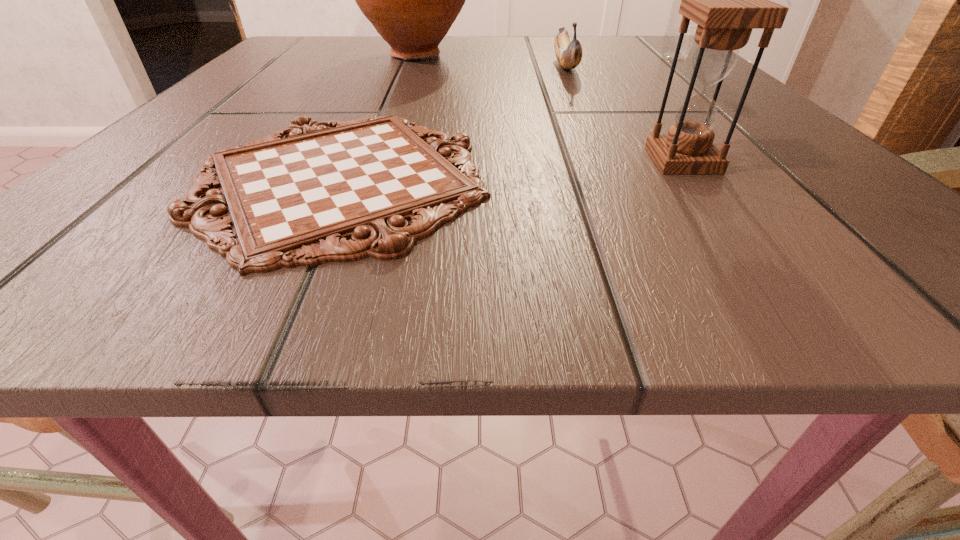
Where is `vacant area that lies between the pottery and the chessboard`? vacant area that lies between the pottery and the chessboard is located at coordinates (378, 117).

The height and width of the screenshot is (540, 960). I want to click on free space between the second object from right to left and the banana, so click(624, 113).

At what (x,y) coordinates should I click in order to perform the action: click on unoccupied position between the third tallest object and the third object from left to right. Please return your answer as a coordinate pair (x, y). This screenshot has width=960, height=540. Looking at the image, I should click on (624, 113).

In order to click on free space that is in between the water bottle and the pottery in this screenshot , I will do `click(545, 57)`.

Identify the location of free area in between the third object from left to right and the hourglass. The image size is (960, 540). (624, 113).

In order to click on free space that is in between the pottery and the rightmost object in this screenshot , I will do `click(545, 57)`.

This screenshot has width=960, height=540. I want to click on empty space that is in between the shortest object and the third object from left to right, so click(452, 122).

Identify the location of object that is the third closest to the rightmost object. (727, 0).

Identify which object is the fourth nearest to the pottery. Please provide its 2D coordinates. Your answer should be formatted as a tuple, i.e. [(x, y)], where the tuple contains the x and y coordinates of a point satisfying the conditions above.

[(727, 0)]

This screenshot has height=540, width=960. Find the location of `free space that satisfies the following two spatial constraints: 1. on the side of the water bottle with the handle; 2. on the right side of the pottery`. free space that satisfies the following two spatial constraints: 1. on the side of the water bottle with the handle; 2. on the right side of the pottery is located at coordinates (415, 58).